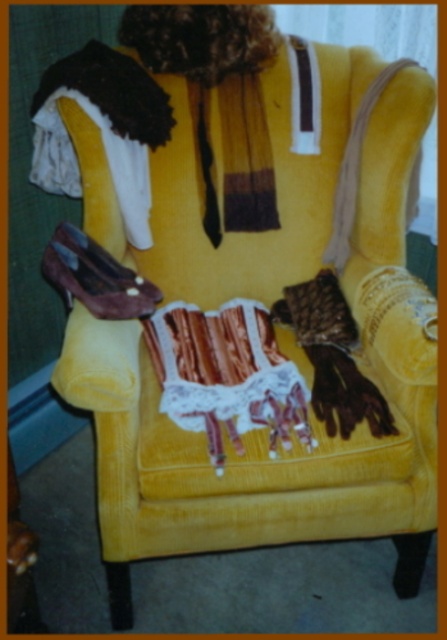
You are a fashion designer preparing for a photoshoot and need to arrange the brown textured scarf at center and the shiny brown leather shoe at lower left. The camera requires a minimum distance of 50 centimeters between objects to capture both clearly. Based on the scene description, will the current placement allow for a clear photo?

The distance between the brown textured scarf at center and the shiny brown leather shoe at lower left is 45.69 centimeters, which is less than the required 50 centimeters. Therefore, the current placement will not allow for a clear photo as they are too close together.

You are a costume designer preparing for a play. You have to decide whether to place the shiny brown leather shoe at lower left on top of the brown textured scarf at center. Based on their positions, will the shoe be visible once placed there?

The brown textured scarf at center is closer to the viewer than the shiny brown leather shoe at lower left. If you place the shoe on top of the scarf, the shoe will be behind the scarf from the viewer perspective, so it won